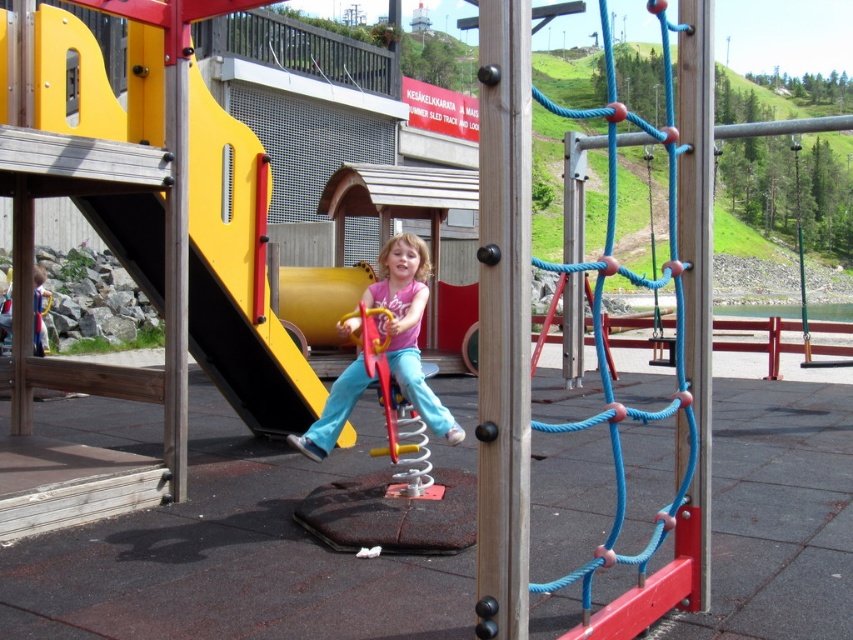
Question: Does blue rope swing at center right have a larger size compared to pink matte shirt at center?

Choices:
 (A) yes
 (B) no

Answer: (A)

Question: Which object is farther from the camera taking this photo?

Choices:
 (A) blue rope swing at center right
 (B) pink matte shirt at center

Answer: (B)

Question: Can you confirm if blue rope swing at center right is wider than pink matte shirt at center?

Choices:
 (A) yes
 (B) no

Answer: (A)

Question: Can you confirm if blue rope swing at center right is positioned above pink matte shirt at center?

Choices:
 (A) no
 (B) yes

Answer: (B)

Question: Which point is closer to the camera?

Choices:
 (A) (422, 252)
 (B) (643, 550)

Answer: (B)